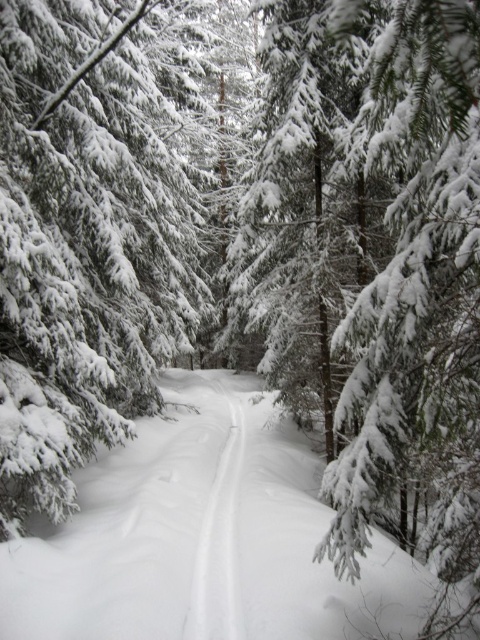
You are a hiker trying to follow the white snow trail at center through the forest. There is a green textured pine tree at center blocking your path. Can you walk around it without leaving the trail?

The green textured pine tree at center is further to the viewer than the white snow trail at center, meaning the tree is closer to you. Since the trail is behind the tree, you can walk around the tree along the trail without leaving it.

You are an explorer in a snowy forest and need to cross the path made by the tracks. You have a 4.3 meters long rope. Can you use it to bridge the gap between the green textured pine tree at center and the white fluffy snow at center?

The green textured pine tree at center is 4.37 meters away from white fluffy snow at center. Since the rope is only 4.3 meters long, it is 0.07 meters shorter than the required distance. Therefore, the rope is not long enough to bridge the gap between the green textured pine tree at center and the white fluffy snow at center.

You are standing at the starting point of the ski path in the forest. You notice two points marked in the scene. Which point is closer to you, point (202, 600) or point (237, 406)?

Point (202, 600) is closer to the viewer than point (237, 406).